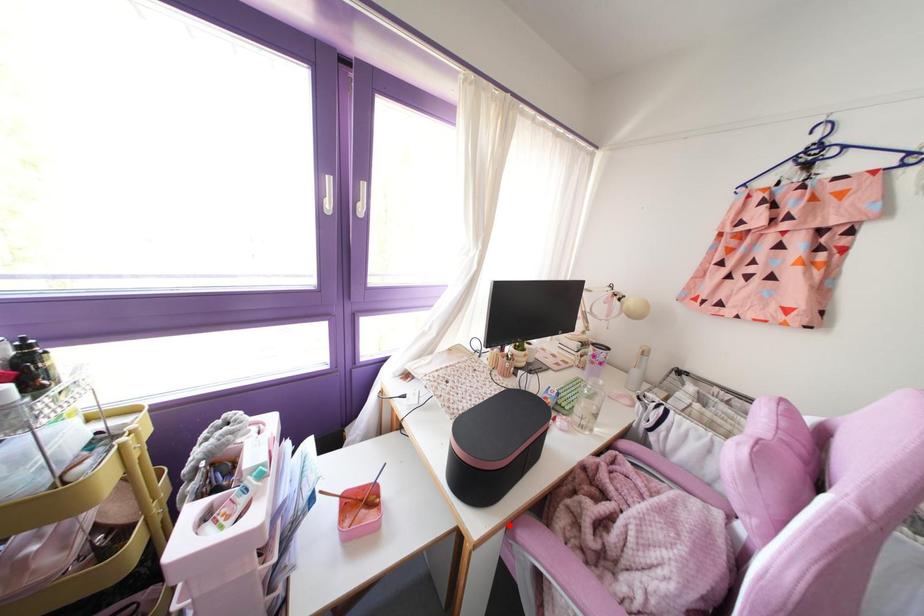
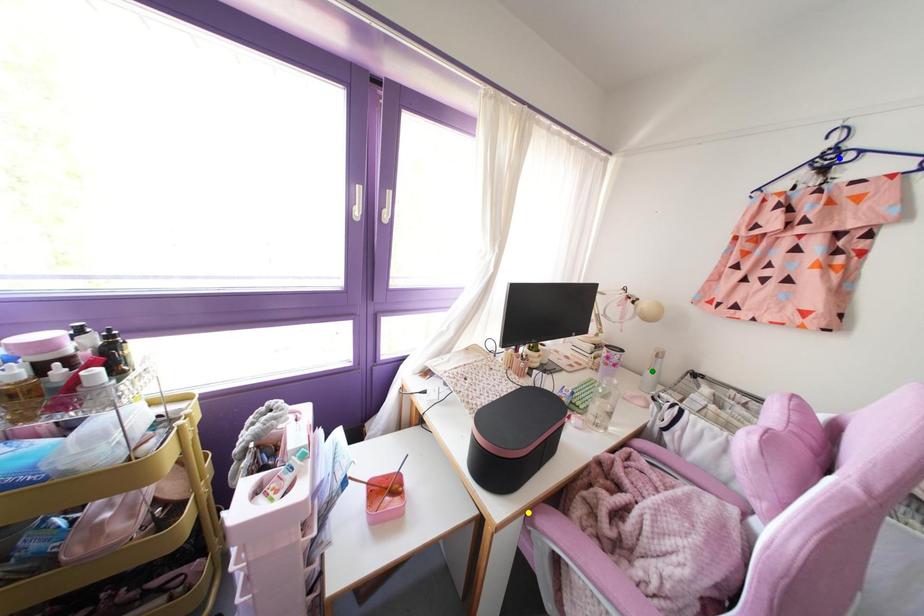
Question: I am providing you with two images of the same scene from different viewpoints. A red point is marked on the first image. You are given multiple points on the second image. Which point in image 2 is actually the same real-world point as the red point in image 1?

Choices:
 (A) yellow point
 (B) blue point
 (C) green point

Answer: (A)